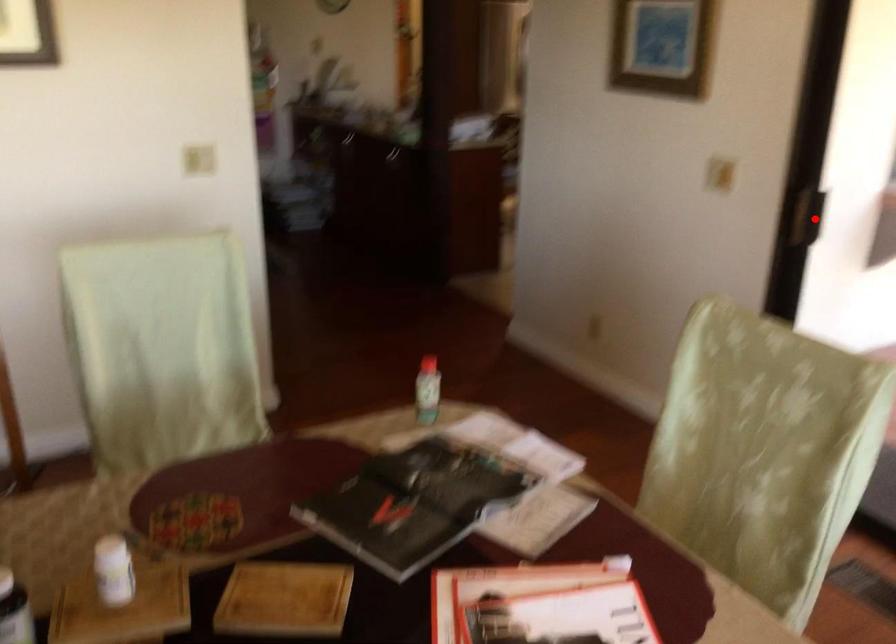
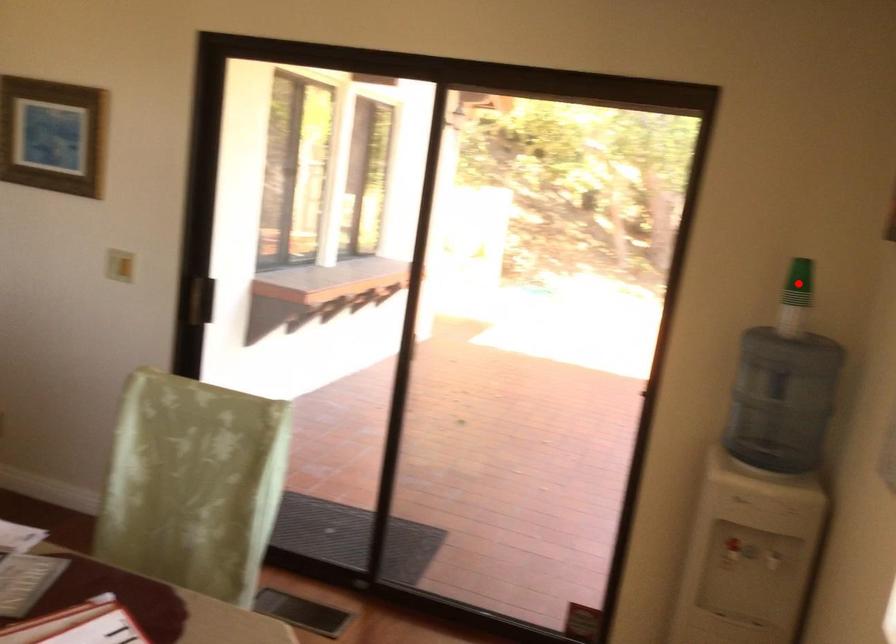
I am providing you with two images of the same scene from different viewpoints. A red point is marked on the first image and another point is marked on the second image. Is the red point in image1 aligned with the point shown in image2?

No